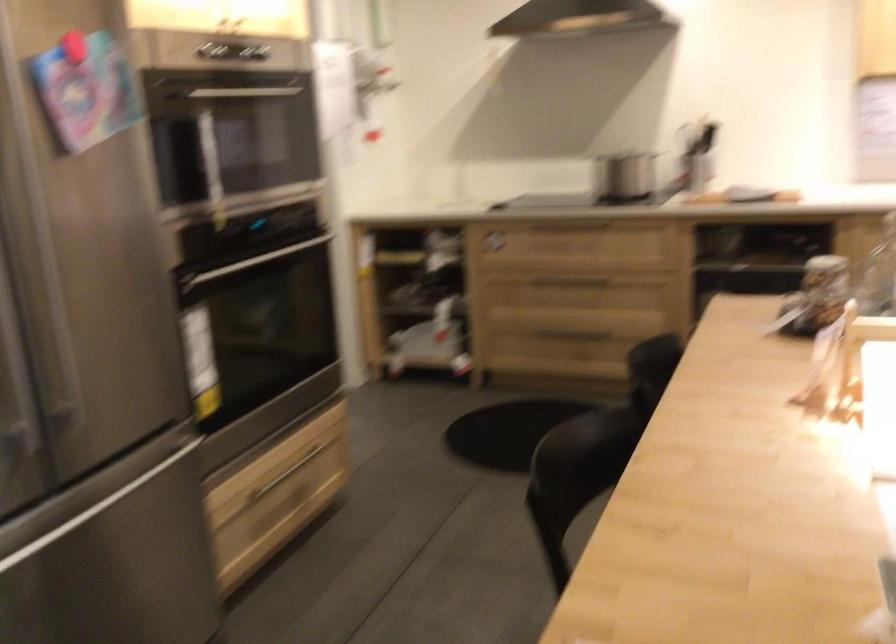
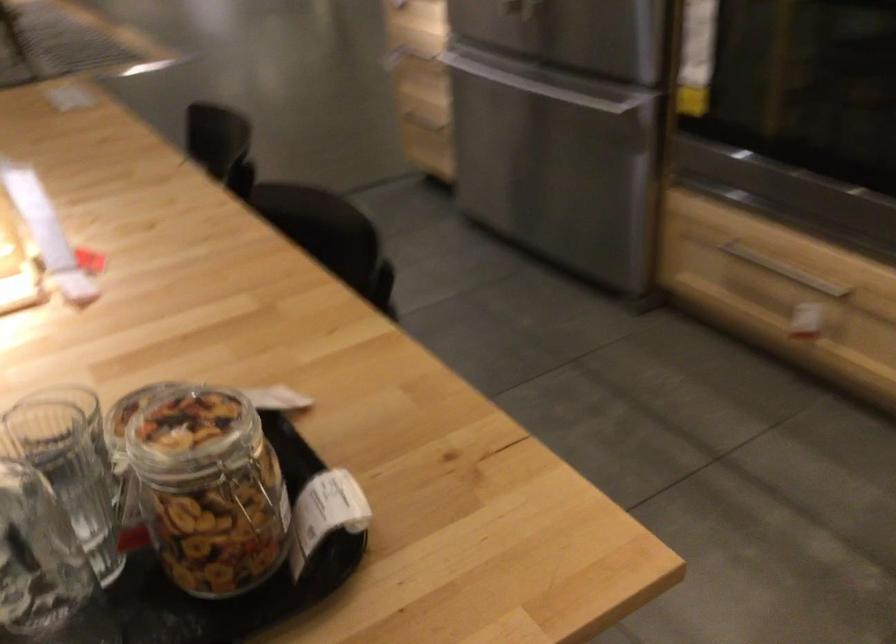
Find the pixel in the second image that matches (815,267) in the first image.

(209, 489)